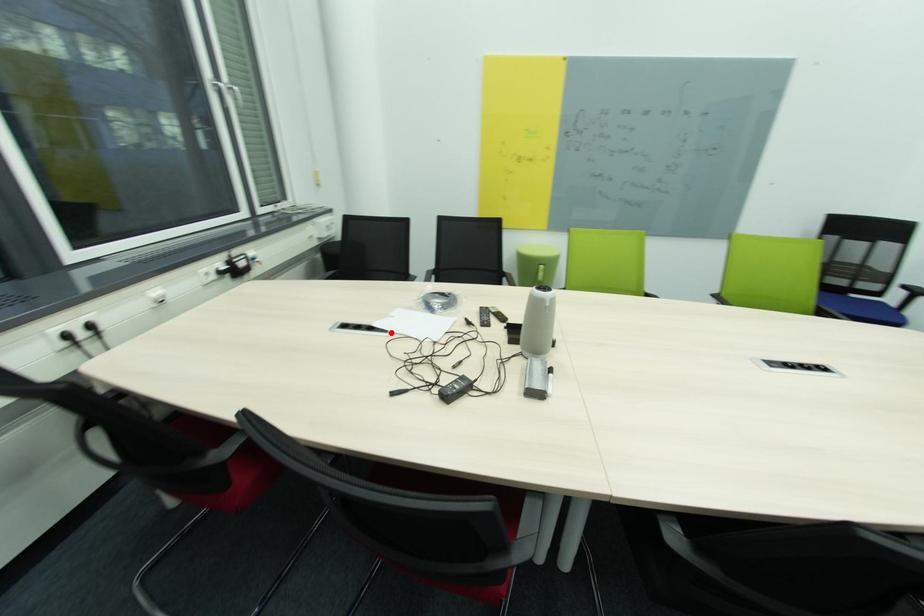
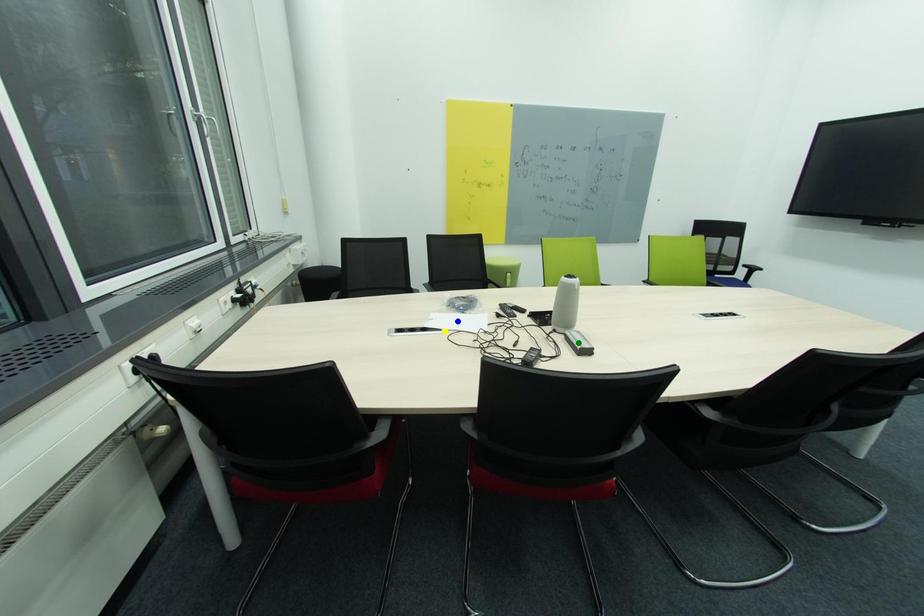
Question: I am providing you with two images of the same scene from different viewpoints. A red point is marked on the first image. You are given multiple points on the second image. Which spot in image 2 lines up with the point in image 1?

Choices:
 (A) blue point
 (B) yellow point
 (C) green point

Answer: (B)